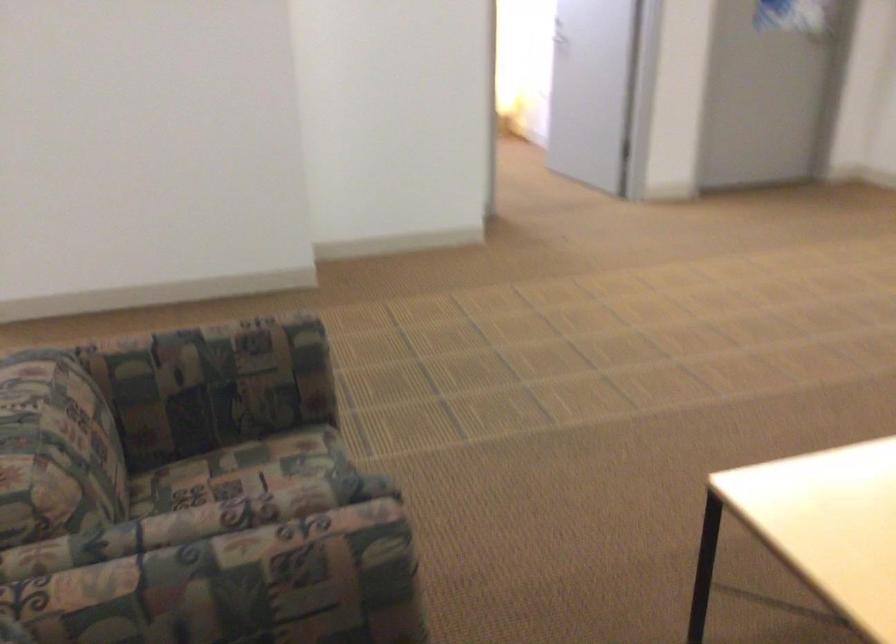
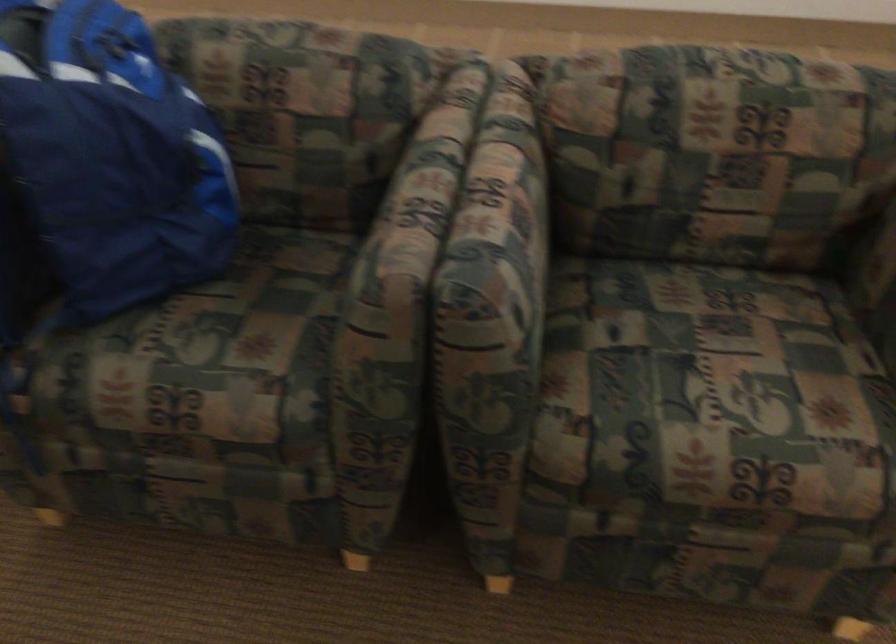
In the second image, find the point that corresponds to point 245,498 in the first image.

(510, 196)